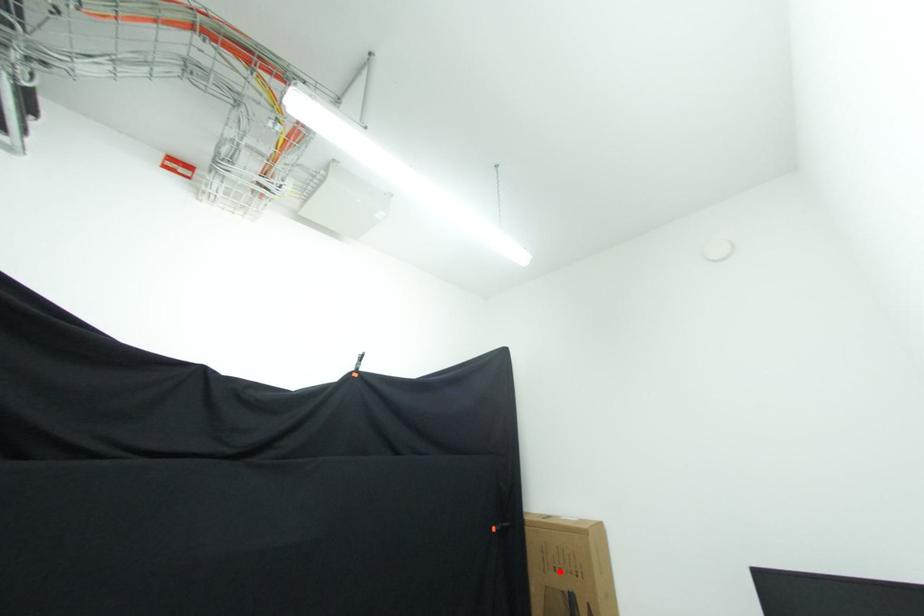
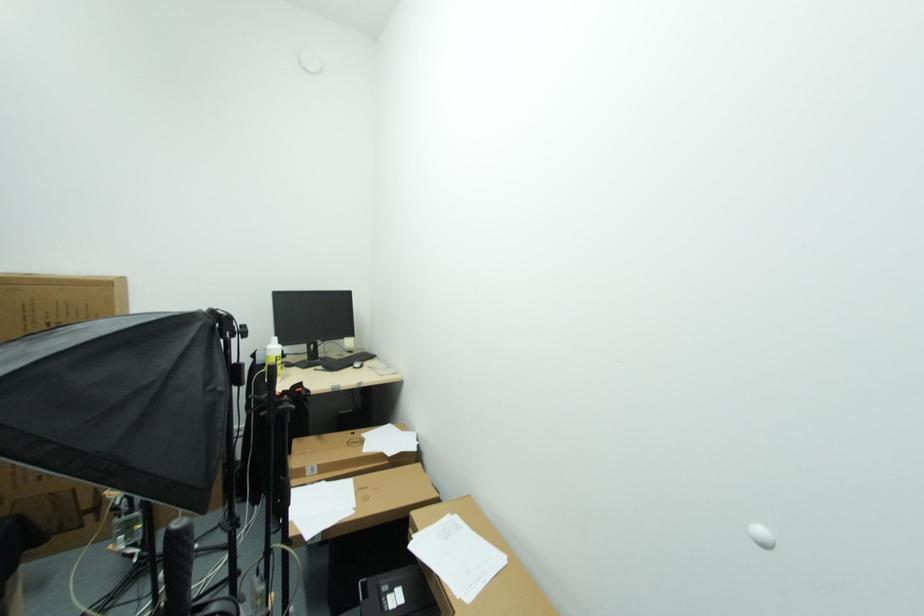
Find the pixel in the second image that matches the highlighted location in the first image.

(53, 328)